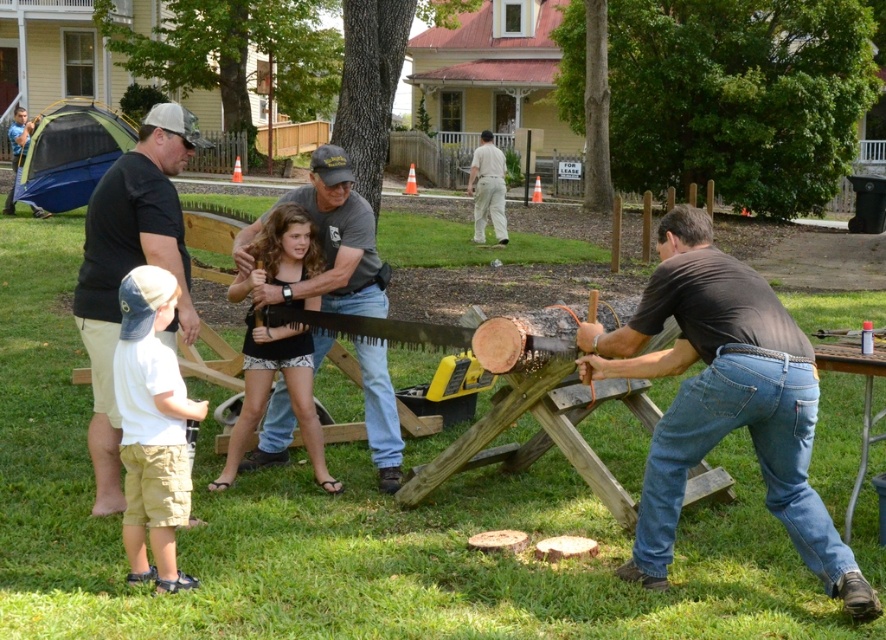
Who is more forward, [509,264] or [109,310]?

Point [109,310] is more forward.

Does wooden sawhorse at center have a greater width compared to black cotton t-shirt at left?

Yes, wooden sawhorse at center is wider than black cotton t-shirt at left.

What do you see at coordinates (346, 525) in the screenshot?
I see `wooden sawhorse at center` at bounding box center [346, 525].

Locate an element on the screen. Image resolution: width=886 pixels, height=640 pixels. wooden sawhorse at center is located at coordinates (346, 525).

Is black fabric dress at center taller than wooden picnic table at lower right?

Yes, black fabric dress at center is taller than wooden picnic table at lower right.

Between black fabric dress at center and wooden picnic table at lower right, which one has less height?

With less height is wooden picnic table at lower right.

The width and height of the screenshot is (886, 640). I want to click on black fabric dress at center, so [x=268, y=394].

The image size is (886, 640). I want to click on black fabric dress at center, so [x=268, y=394].

Does brown cotton shirt at right appear on the left side of black cotton t-shirt at left?

In fact, brown cotton shirt at right is to the right of black cotton t-shirt at left.

Which is in front, point (605, 342) or point (99, 272)?

Point (605, 342) is more forward.

At what (x,y) coordinates should I click in order to perform the action: click on brown cotton shirt at right. Please return your answer as a coordinate pair (x, y). The height and width of the screenshot is (640, 886). Looking at the image, I should click on (723, 401).